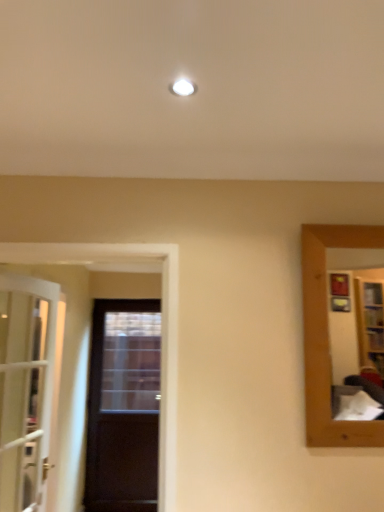
Question: Should I look upward or downward to see white glass door at left, which is the 1th door from left to right?

Choices:
 (A) down
 (B) up

Answer: (A)

Question: Is white glass door at left, which is the second door from back to front, closer to camera compared to dark wood door at center, which appears as the first door when viewed from the right?

Choices:
 (A) yes
 (B) no

Answer: (A)

Question: Does white glass door at left, which is the 1th door from left to right, have a greater width compared to dark wood door at center, which is the 2th door from left to right?

Choices:
 (A) yes
 (B) no

Answer: (A)

Question: From the image's perspective, is white glass door at left, which ranks as the 2th door in right-to-left order, below dark wood door at center, which is the 2th door from left to right?

Choices:
 (A) no
 (B) yes

Answer: (A)

Question: Considering the relative sizes of white glass door at left, which is the 1th door from left to right, and dark wood door at center, which appears as the first door when viewed from the right, in the image provided, is white glass door at left, which is the 1th door from left to right, taller than dark wood door at center, which appears as the first door when viewed from the right,?

Choices:
 (A) yes
 (B) no

Answer: (B)

Question: Does white glass door at left, the first door when ordered from front to back, lie behind dark wood door at center, which is the 2th door from left to right?

Choices:
 (A) no
 (B) yes

Answer: (A)

Question: Does white glass door at left, which ranks as the 2th door in right-to-left order, turn towards dark wood door at center, which appears as the first door when viewed from the right?

Choices:
 (A) yes
 (B) no

Answer: (B)

Question: From the image's perspective, is dark wood door at center, which appears as the second door when viewed from the front, located beneath white glass door at left, which is the 1th door from left to right?

Choices:
 (A) yes
 (B) no

Answer: (A)

Question: Is dark wood door at center, which appears as the second door when viewed from the front, to the left of white glass door at left, the first door when ordered from front to back, from the viewer's perspective?

Choices:
 (A) no
 (B) yes

Answer: (A)

Question: From a real-world perspective, is dark wood door at center, which appears as the second door when viewed from the front, physically below white glass door at left, the first door when ordered from front to back?

Choices:
 (A) yes
 (B) no

Answer: (A)

Question: Considering the relative sizes of dark wood door at center, which appears as the second door when viewed from the front, and white glass door at left, which is the 1th door from left to right, in the image provided, is dark wood door at center, which appears as the second door when viewed from the front, thinner than white glass door at left, which is the 1th door from left to right,?

Choices:
 (A) no
 (B) yes

Answer: (B)

Question: From a real-world perspective, is dark wood door at center, which appears as the second door when viewed from the front, on white glass door at left, the first door when ordered from front to back?

Choices:
 (A) no
 (B) yes

Answer: (A)

Question: Does dark wood door at center, which is the 2th door from left to right, contain white glass door at left, the first door when ordered from front to back?

Choices:
 (A) yes
 (B) no

Answer: (B)

Question: Considering the relative positions of dark wood door at center, the 1th door when ordered from back to front, and white glass door at left, the first door when ordered from front to back, in the image provided, is dark wood door at center, the 1th door when ordered from back to front, to the left or to the right of white glass door at left, the first door when ordered from front to back,?

Choices:
 (A) right
 (B) left

Answer: (A)